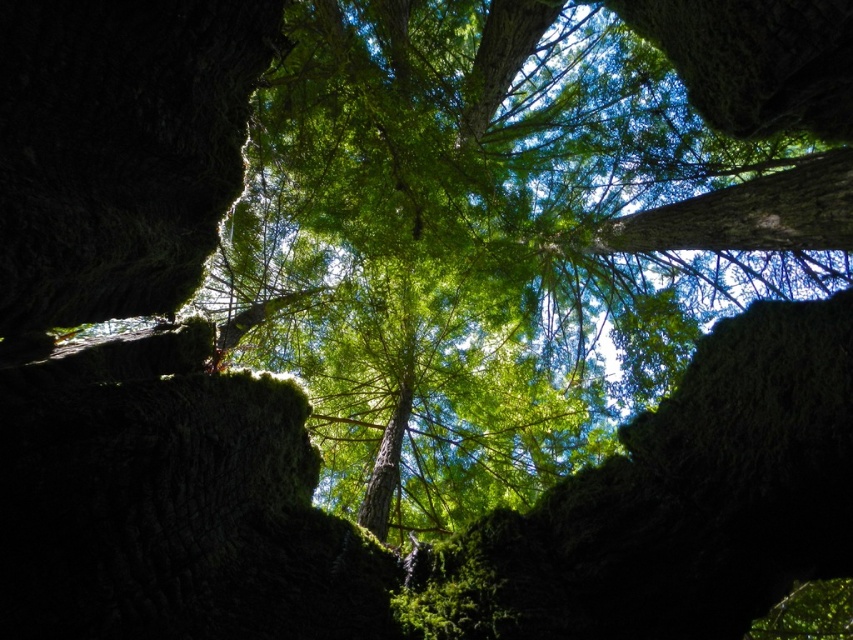
Is dark brown rough tree trunk at left wider than green rough bark tree trunk at center?

Yes.

Who is more distant from viewer, (135,138) or (387,458)?

Positioned behind is point (387,458).

Describe the element at coordinates (119, 148) in the screenshot. I see `dark brown rough tree trunk at left` at that location.

Identify the location of dark brown rough tree trunk at left. (119, 148).